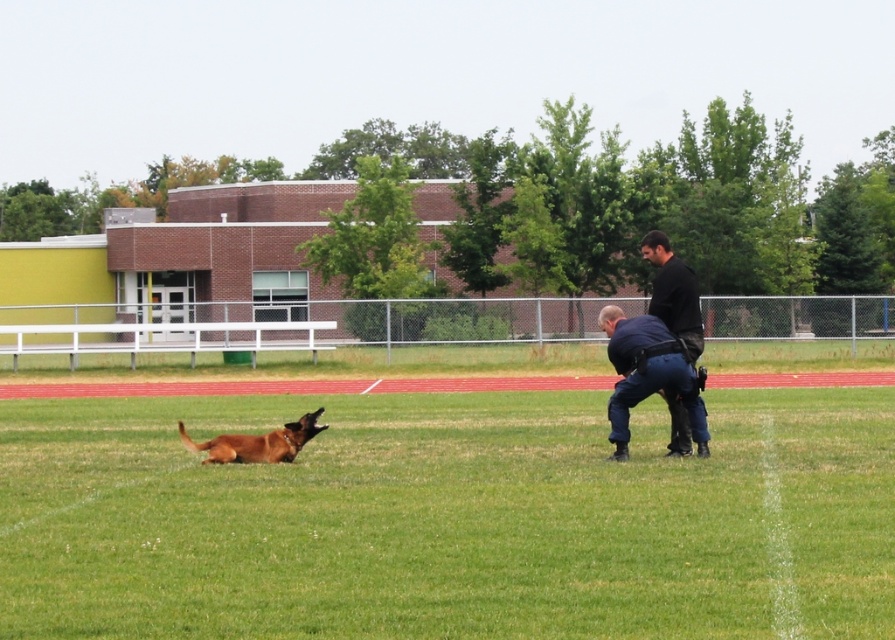
The image size is (895, 640). What do you see at coordinates (449, 518) in the screenshot?
I see `green grass at center` at bounding box center [449, 518].

Can you confirm if green grass at center is positioned below brown matte dog at lower left?

Correct, green grass at center is located below brown matte dog at lower left.

Who is more forward, (172, 486) or (203, 442)?

Point (172, 486)

The width and height of the screenshot is (895, 640). Find the location of `green grass at center`. green grass at center is located at coordinates coord(449,518).

Which is in front, point (638, 385) or point (215, 436)?

Point (638, 385)

Is dark blue uniform at center thinner than brown matte dog at lower left?

Yes, dark blue uniform at center is thinner than brown matte dog at lower left.

Which is behind, point (636, 397) or point (316, 419)?

Positioned behind is point (316, 419).

Locate an element on the screen. The height and width of the screenshot is (640, 895). dark blue uniform at center is located at coordinates (648, 378).

Based on the photo, is dark blue uniform at center taller than black smooth shirt at center?

No.

Between dark blue uniform at center and black smooth shirt at center, which one is positioned higher?

black smooth shirt at center is above.

What do you see at coordinates (648, 378) in the screenshot? This screenshot has width=895, height=640. I see `dark blue uniform at center` at bounding box center [648, 378].

Identify the location of dark blue uniform at center. [648, 378].